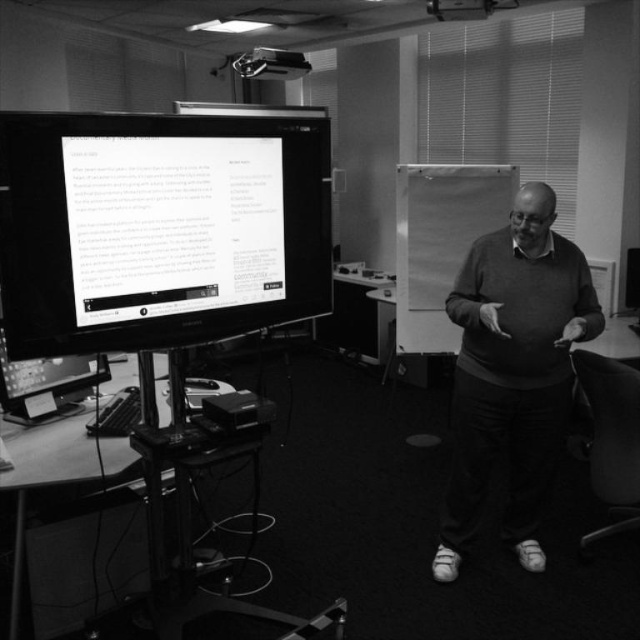
Question: In this image, where is matte sweater at center located relative to smooth plastic swivel chair at lower right?

Choices:
 (A) below
 (B) above

Answer: (B)

Question: Which object is farther from the camera taking this photo?

Choices:
 (A) matte black monitor at left
 (B) matte sweater at center

Answer: (B)

Question: Estimate the real-world distances between objects in this image. Which object is farther from the matte black monitor at left?

Choices:
 (A) matte sweater at center
 (B) smooth plastic swivel chair at lower right

Answer: (B)

Question: From the image, what is the correct spatial relationship of matte sweater at center in relation to smooth plastic swivel chair at lower right?

Choices:
 (A) above
 (B) below

Answer: (A)

Question: Can you confirm if matte black monitor at left is positioned to the left of smooth plastic swivel chair at lower right?

Choices:
 (A) no
 (B) yes

Answer: (B)

Question: Based on their relative distances, which object is farther from the matte sweater at center?

Choices:
 (A) matte black monitor at left
 (B) smooth plastic swivel chair at lower right

Answer: (A)